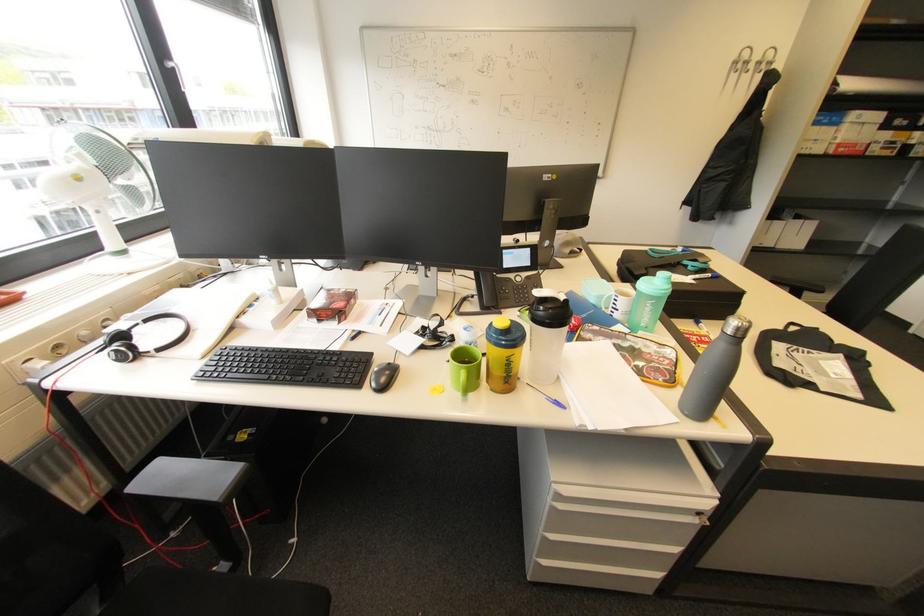
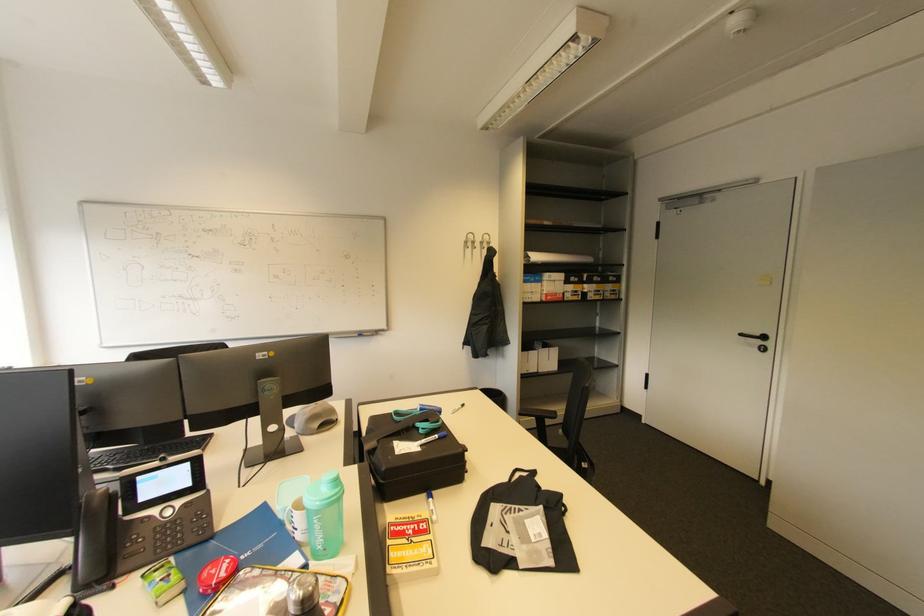
Question: I am providing you with two images of the same scene from different viewpoints. Which of the following objects are not visible in image2?

Choices:
 (A) white binder
 (B) blue notebook
 (C) grey baseball cap
 (D) none of these

Answer: (D)